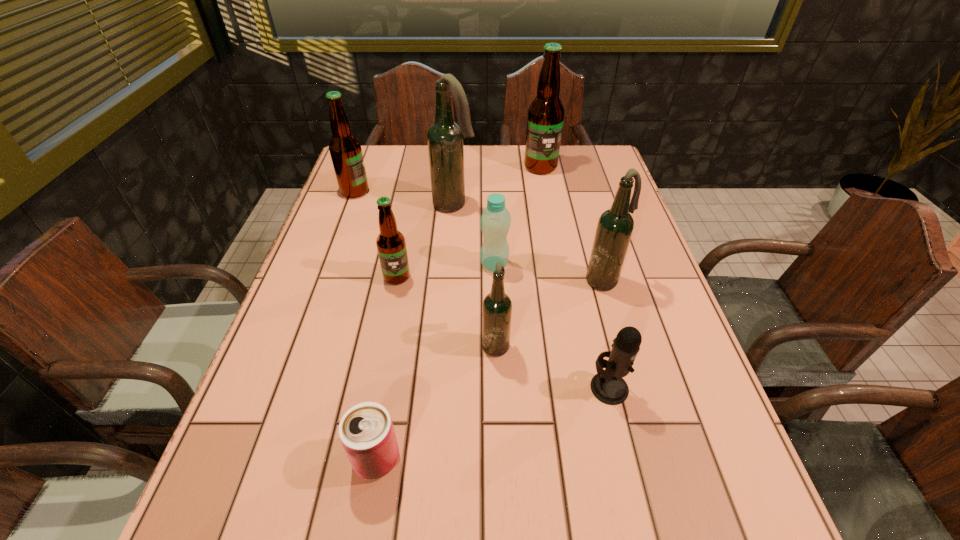
Locate an element on the screen. The height and width of the screenshot is (540, 960). the rightmost brown beer bottle is located at coordinates (545, 119).

Where is `the farthest brown beer bottle`? Image resolution: width=960 pixels, height=540 pixels. the farthest brown beer bottle is located at coordinates (545, 119).

Where is `the leftmost dark beer bottle`? the leftmost dark beer bottle is located at coordinates (445, 137).

Locate an element on the screen. The image size is (960, 540). the biggest dark beer bottle is located at coordinates (445, 137).

The height and width of the screenshot is (540, 960). I want to click on the rightmost beer bottle, so click(615, 226).

Locate an element on the screen. The height and width of the screenshot is (540, 960). the second nearest dark beer bottle is located at coordinates (615, 226).

Image resolution: width=960 pixels, height=540 pixels. Find the location of `the second nearest brown beer bottle`. the second nearest brown beer bottle is located at coordinates (345, 149).

Find the location of a particular element. This screenshot has height=540, width=960. the leftmost object is located at coordinates (345, 149).

Identify the location of the second brown beer bottle from right to left. (391, 246).

Where is `the nearest brown beer bottle`? This screenshot has height=540, width=960. the nearest brown beer bottle is located at coordinates (391, 246).